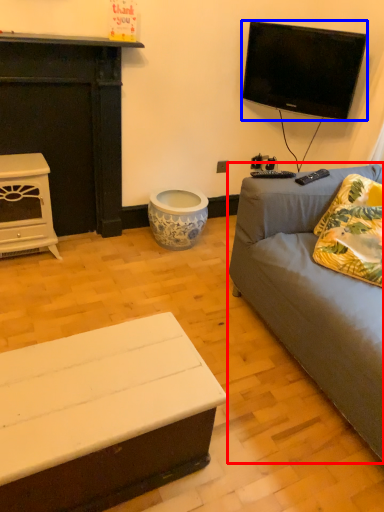
Question: Which object appears farthest to the camera in this image, studio couch (highlighted by a red box) or television (highlighted by a blue box)?

Choices:
 (A) studio couch
 (B) television

Answer: (B)